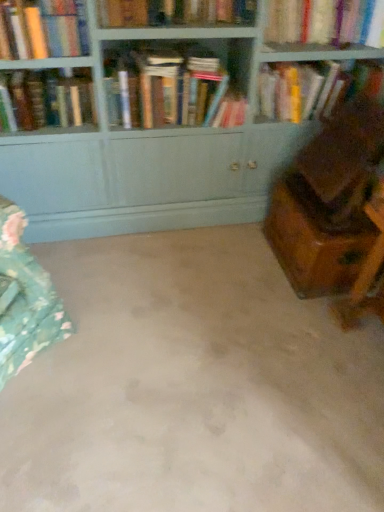
Question: Are matte wood bookcase at upper center and hardcover book at upper left, which appears as the 6th book when viewed from the right, far apart?

Choices:
 (A) no
 (B) yes

Answer: (A)

Question: From the image's perspective, does matte wood bookcase at upper center appear lower than hardcover book at upper left, which appears as the 6th book when viewed from the right?

Choices:
 (A) yes
 (B) no

Answer: (A)

Question: Does matte wood bookcase at upper center have a lesser height compared to hardcover book at upper left, which appears as the 6th book when viewed from the right?

Choices:
 (A) yes
 (B) no

Answer: (B)

Question: From the image's perspective, is matte wood bookcase at upper center located above hardcover book at upper left, which appears as the 6th book when viewed from the right?

Choices:
 (A) yes
 (B) no

Answer: (B)

Question: Does matte wood bookcase at upper center have a smaller size compared to hardcover book at upper left, which appears as the 6th book when viewed from the right?

Choices:
 (A) yes
 (B) no

Answer: (B)

Question: Considering the positions of wooden chest at right and beige carpet at center in the image, is wooden chest at right bigger or smaller than beige carpet at center?

Choices:
 (A) big
 (B) small

Answer: (B)

Question: From the image's perspective, relative to beige carpet at center, is wooden chest at right above or below?

Choices:
 (A) below
 (B) above

Answer: (B)

Question: From a real-world perspective, is wooden chest at right above or below beige carpet at center?

Choices:
 (A) below
 (B) above

Answer: (B)

Question: Is wooden chest at right taller or shorter than beige carpet at center?

Choices:
 (A) short
 (B) tall

Answer: (B)

Question: In the image, is hardcover book at upper left, which appears as the first book when viewed from the left, positioned in front of or behind beige carpet at center?

Choices:
 (A) behind
 (B) front

Answer: (A)

Question: In the image, is hardcover book at upper left, which appears as the first book when viewed from the left, on the left side or the right side of beige carpet at center?

Choices:
 (A) left
 (B) right

Answer: (A)

Question: From the image's perspective, is hardcover book at upper left, which appears as the first book when viewed from the left, located above or below beige carpet at center?

Choices:
 (A) below
 (B) above

Answer: (B)

Question: Would you say hardcover book at upper left, which appears as the 6th book when viewed from the right, is inside or outside beige carpet at center?

Choices:
 (A) outside
 (B) inside

Answer: (A)

Question: Based on their positions, is hardcover books at center, marked as the 4th book in a right-to-left arrangement, located to the left or right of matte wood bookcase at upper center?

Choices:
 (A) right
 (B) left

Answer: (B)

Question: Considering the positions of hardcover books at center, marked as the 4th book in a right-to-left arrangement, and matte wood bookcase at upper center in the image, is hardcover books at center, marked as the 4th book in a right-to-left arrangement, bigger or smaller than matte wood bookcase at upper center?

Choices:
 (A) small
 (B) big

Answer: (A)